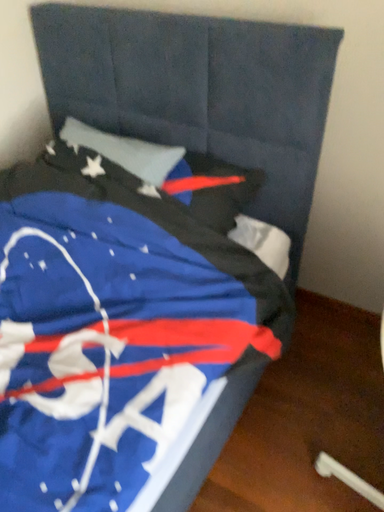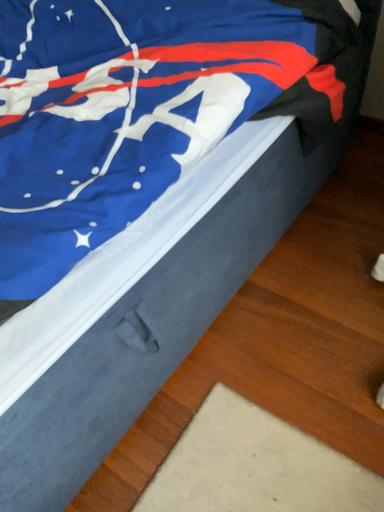
Question: Which way did the camera rotate in the video?

Choices:
 (A) rotated right
 (B) rotated left

Answer: (B)